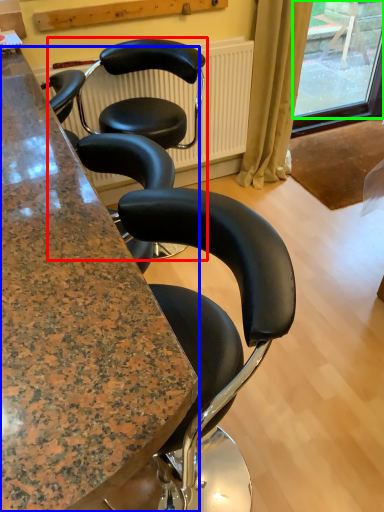
Question: Based on their relative distances, which object is nearer to chair (highlighted by a red box)? Choose from cabinetry (highlighted by a blue box) and window screen (highlighted by a green box).

Choices:
 (A) cabinetry
 (B) window screen

Answer: (A)